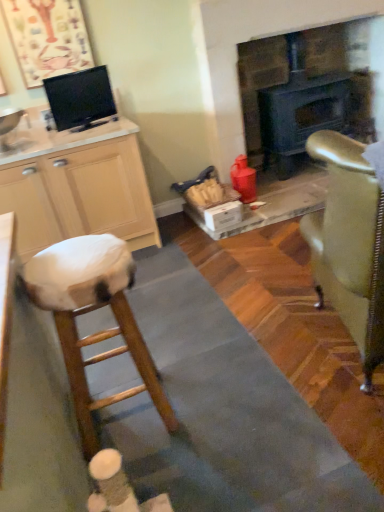
Question: Does wooden stool at left have a lesser width compared to white glossy sink at left?

Choices:
 (A) no
 (B) yes

Answer: (B)

Question: Is wooden stool at left positioned with its back to white glossy sink at left?

Choices:
 (A) no
 (B) yes

Answer: (A)

Question: Is wooden stool at left facing towards white glossy sink at left?

Choices:
 (A) yes
 (B) no

Answer: (B)

Question: Considering the relative sizes of wooden stool at left and white glossy sink at left in the image provided, is wooden stool at left bigger than white glossy sink at left?

Choices:
 (A) yes
 (B) no

Answer: (A)

Question: From a real-world perspective, does wooden stool at left sit lower than white glossy sink at left?

Choices:
 (A) yes
 (B) no

Answer: (A)

Question: From the image's perspective, does wooden stool at left appear lower than white glossy sink at left?

Choices:
 (A) yes
 (B) no

Answer: (A)

Question: Is the depth of wooden stool at left greater than that of black glossy tv at upper left?

Choices:
 (A) no
 (B) yes

Answer: (A)

Question: Considering the relative positions of wooden stool at left and black glossy tv at upper left in the image provided, is wooden stool at left to the left of black glossy tv at upper left from the viewer's perspective?

Choices:
 (A) yes
 (B) no

Answer: (B)

Question: Is wooden stool at left not inside black glossy tv at upper left?

Choices:
 (A) yes
 (B) no

Answer: (A)

Question: Is wooden stool at left far from black glossy tv at upper left?

Choices:
 (A) no
 (B) yes

Answer: (B)

Question: From the image's perspective, is wooden stool at left beneath black glossy tv at upper left?

Choices:
 (A) yes
 (B) no

Answer: (A)

Question: Is wooden stool at left aimed at black glossy tv at upper left?

Choices:
 (A) no
 (B) yes

Answer: (A)

Question: Is black glossy tv at upper left facing towards wooden stool at left?

Choices:
 (A) yes
 (B) no

Answer: (B)